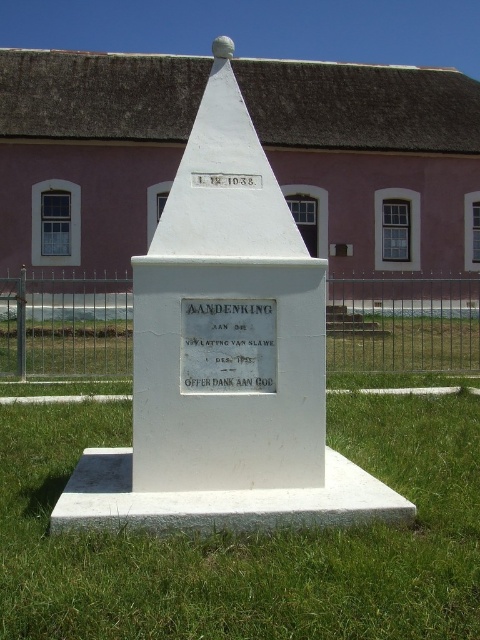
You are standing at the monument and want to walk towards the metallic wire fence at center. Which direction should you walk to reach it?

Walk forward since the metallic wire fence at center is located directly in front of you at point (403, 324).

You are a visitor at the monument and want to place a flower bouquet between the metallic wire fence at center and the white polished stone plaque at center. Which object should you place the bouquet closer to if you want it to be nearer to the narrower object?

The white polished stone plaque at center is narrower than the metallic wire fence at center. Therefore, placing the bouquet closer to the white polished stone plaque at center will make it nearer to the narrower object.